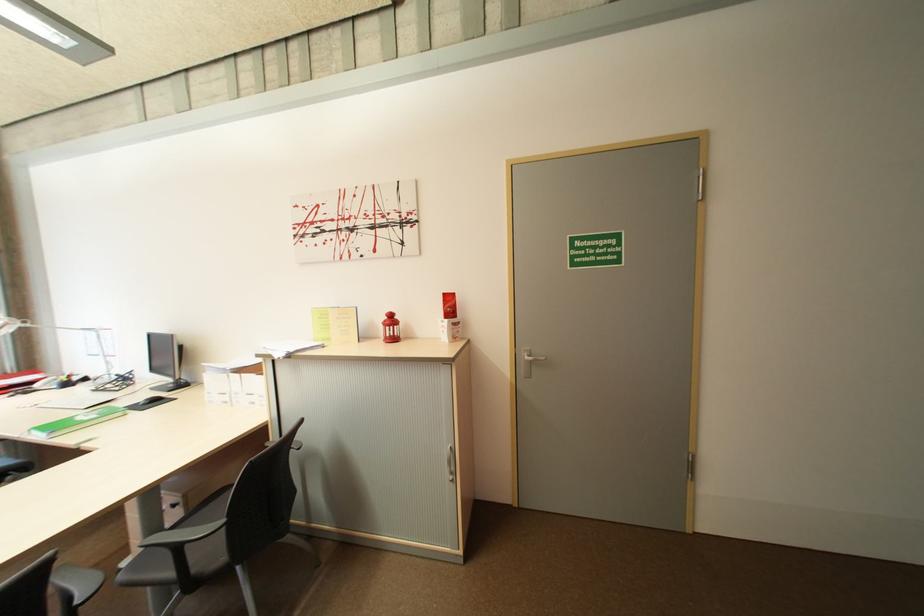
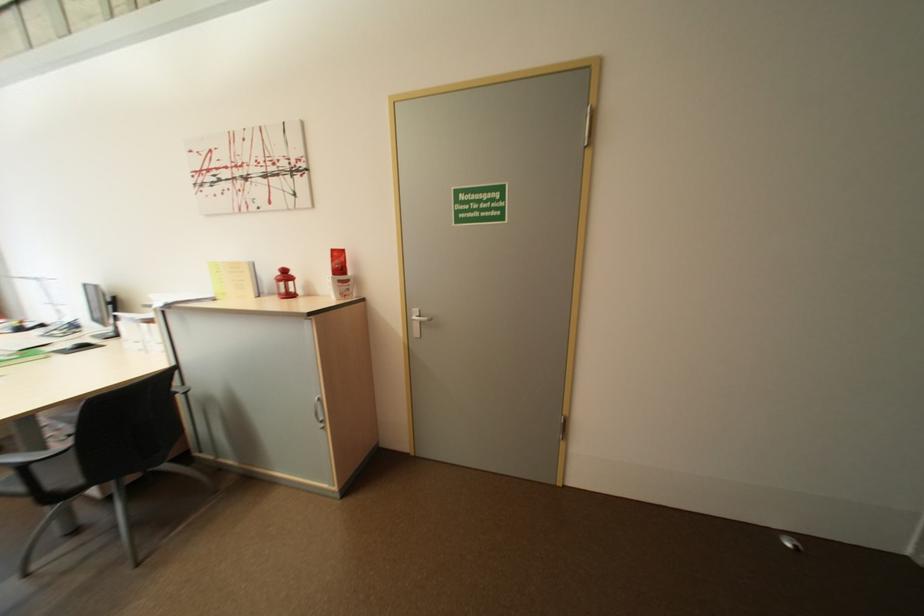
In the second image, find the point that corresponds to (337,339) in the first image.

(234, 294)